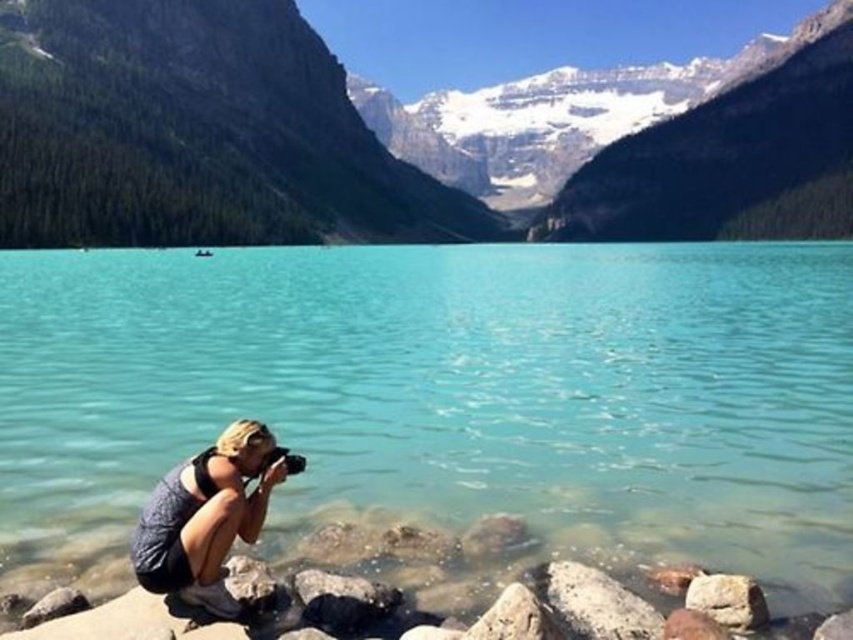
Is gray fabric camera at lower left positioned in front of smooth gray rock at lower right?

That is True.

Which is in front, point (199, 557) or point (688, 593)?

Positioned in front is point (199, 557).

Identify the location of gray fabric camera at lower left. (207, 515).

Can you confirm if clear glass water at center is positioned above smooth gray rock at lower right?

Correct, clear glass water at center is located above smooth gray rock at lower right.

Which is above, clear glass water at center or smooth gray rock at lower right?

Positioned higher is clear glass water at center.

The image size is (853, 640). What do you see at coordinates (450, 394) in the screenshot?
I see `clear glass water at center` at bounding box center [450, 394].

The width and height of the screenshot is (853, 640). I want to click on clear glass water at center, so (x=450, y=394).

Is point (180, 352) closer to viewer compared to point (610, 224)?

Yes, point (180, 352) is in front of point (610, 224).

Does clear glass water at center have a larger size compared to green forested mountain at upper center?

Actually, clear glass water at center might be smaller than green forested mountain at upper center.

Is point (27, 406) in front of point (822, 232)?

Yes, it is.

Find the location of a particular element. This screenshot has width=853, height=640. clear glass water at center is located at coordinates (450, 394).